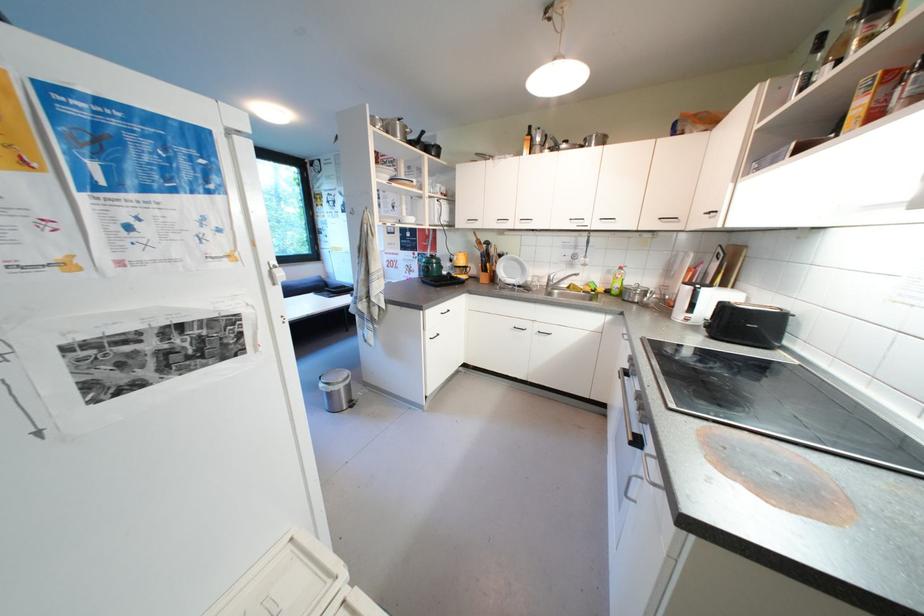
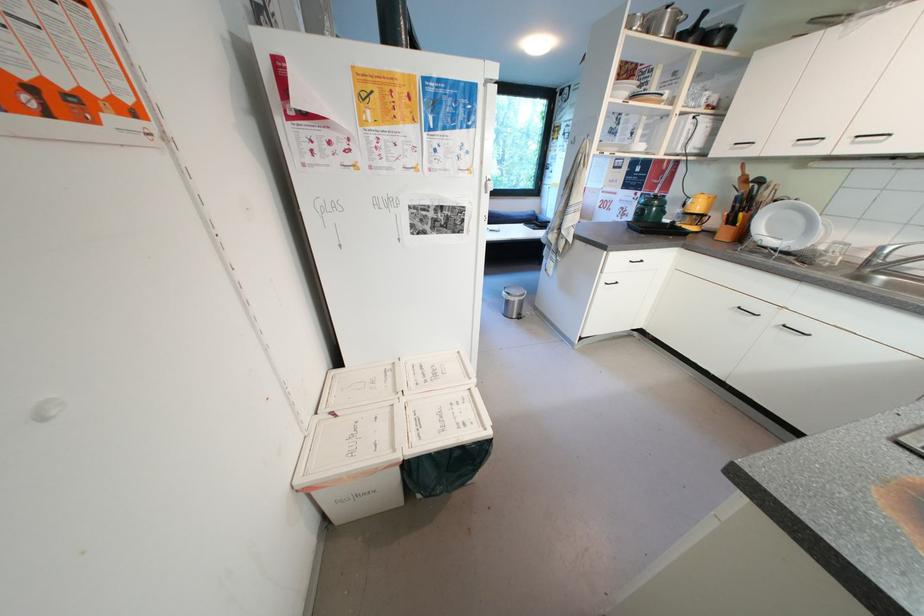
Locate, in the second image, the point that corresponds to [556,282] in the first image.

(883, 257)